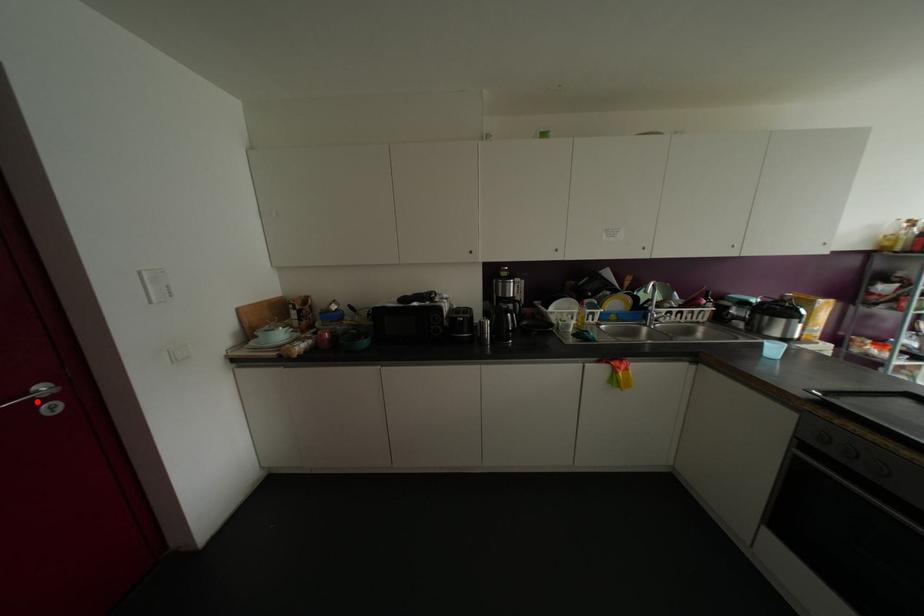
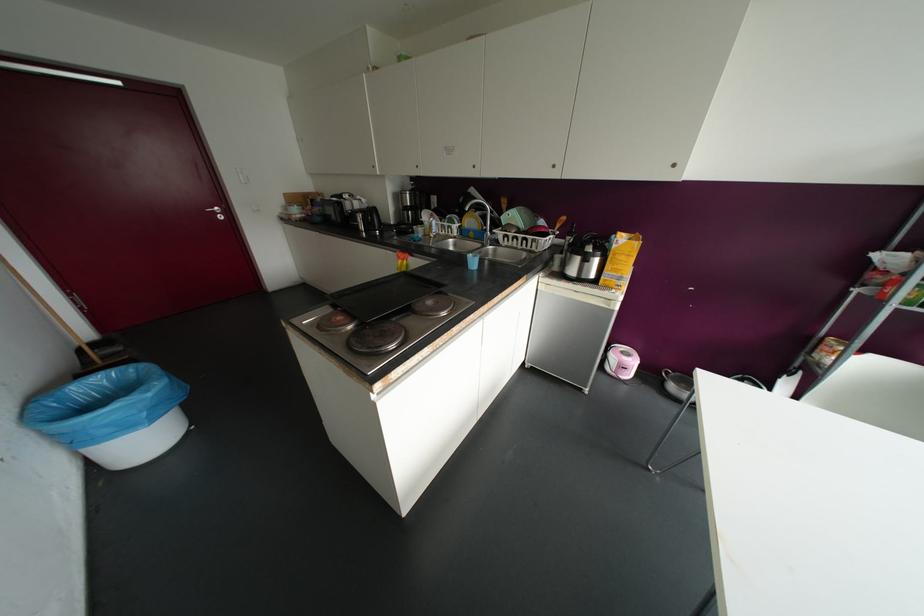
Where in the second image is the point corresponding to the highlighted location from the first image?

(214, 213)